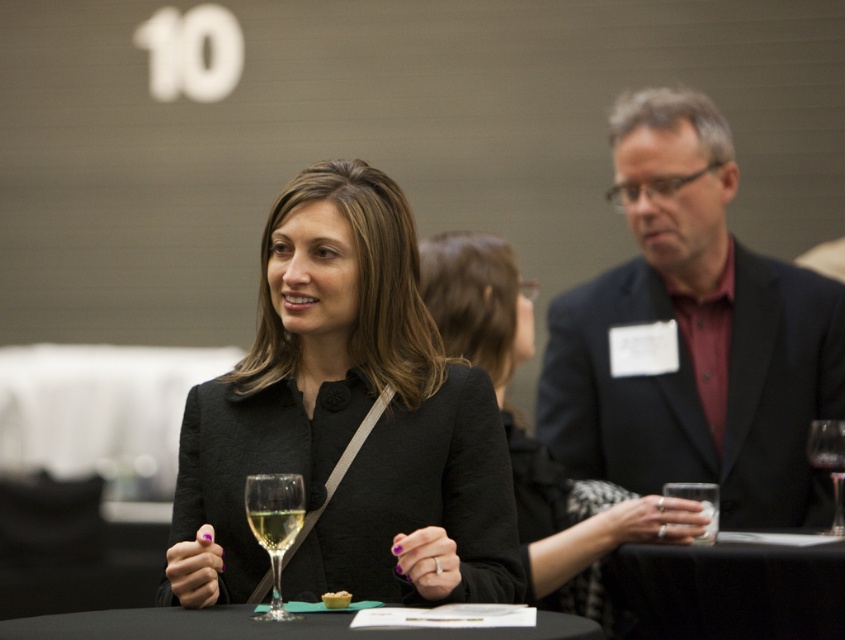
Is point (713, 572) in front of point (482, 637)?

No, (713, 572) is further to viewer.

Measure the distance between black fabric table at lower center and black glass table at center.

black fabric table at lower center and black glass table at center are 3.79 feet apart from each other.

Is point (709, 604) positioned before point (532, 628)?

No, it is behind (532, 628).

Identify the location of black fabric table at lower center. The height and width of the screenshot is (640, 845). (728, 589).

Is matte black blazer at center taller than transparent glass wine glass at center?

Yes.

Is point (600, 552) positioned after point (815, 456)?

Yes, point (600, 552) is behind point (815, 456).

You are a GUI agent. You are given a task and a screenshot of the screen. Output one action in this format:
    pyautogui.click(x=<x>, y=<y>)
    Task: Click on the matte black blazer at center
    
    Given the screenshot: What is the action you would take?
    pyautogui.click(x=533, y=438)

Who is positioned more to the right, black fabric table at lower center or transparent glass wine glass at center?

transparent glass wine glass at center is more to the right.

Looking at this image, does black fabric table at lower center have a lesser width compared to transparent glass wine glass at center?

No, black fabric table at lower center is not thinner than transparent glass wine glass at center.

The height and width of the screenshot is (640, 845). Identify the location of black fabric table at lower center. (728, 589).

The image size is (845, 640). Identify the location of black fabric table at lower center. [728, 589].